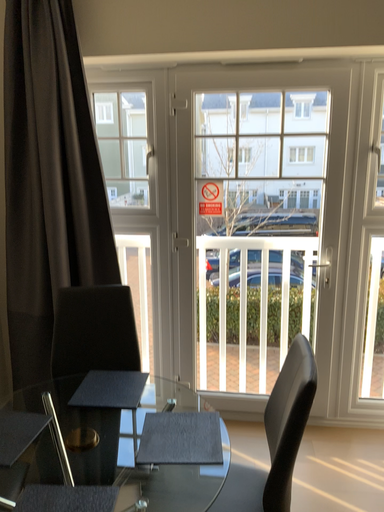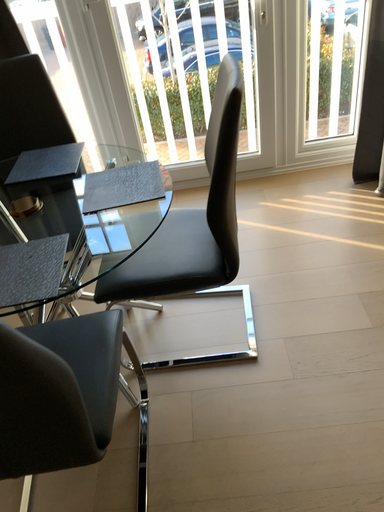
Question: Which way did the camera rotate in the video?

Choices:
 (A) rotated left
 (B) rotated right

Answer: (B)